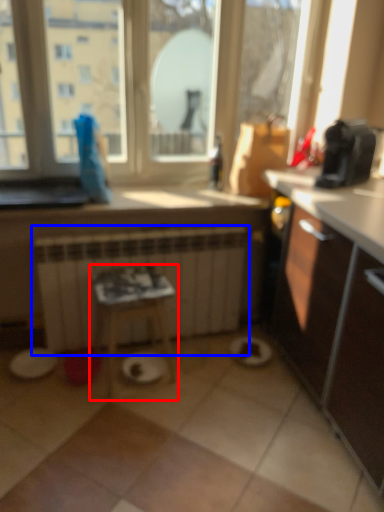
Question: Which point is further to the camera, table (highlighted by a red box) or radiator (highlighted by a blue box)?

Choices:
 (A) table
 (B) radiator

Answer: (B)